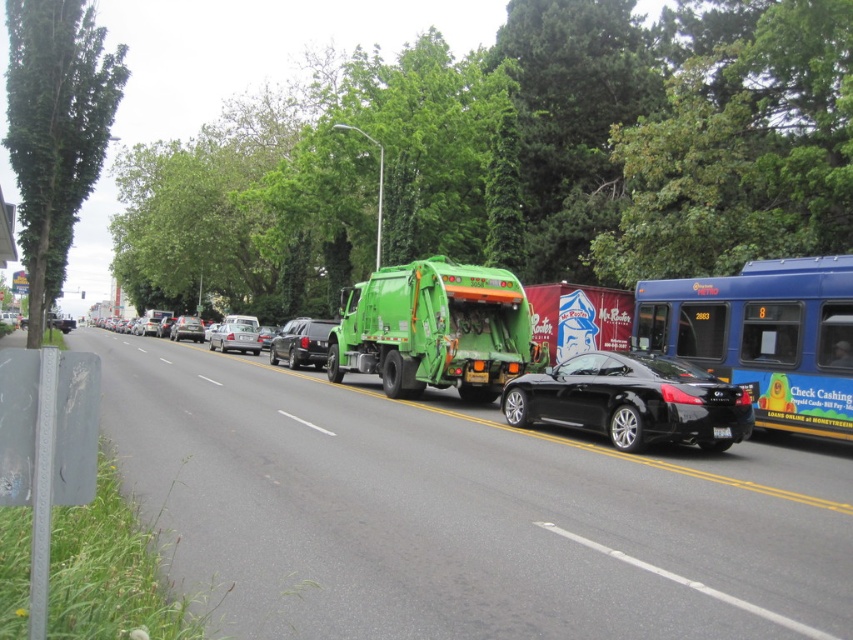
Is shiny silver sedan at center thinner than black plastic license plate at center?

No.

Locate an element on the screen. This screenshot has height=640, width=853. shiny silver sedan at center is located at coordinates (187, 328).

Does blue metallic bus at right have a larger size compared to black plastic license plate at center?

Yes.

Between point (692, 321) and point (728, 429), which one is positioned behind?

The point (692, 321) is behind.

I want to click on blue metallic bus at right, so click(763, 337).

Can you confirm if glossy black car at center is shorter than shiny black suv at center?

Yes.

Find the location of a particular element. The image size is (853, 640). glossy black car at center is located at coordinates (631, 401).